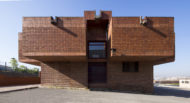
You are a GUI agent. You are given a task and a screenshot of the screen. Output one action in this format:
    pyautogui.click(x=<x>, y=<y>)
    Task: Click on the door
    This screenshot has width=190, height=103.
    Given the screenshot: What is the action you would take?
    pyautogui.click(x=101, y=74)